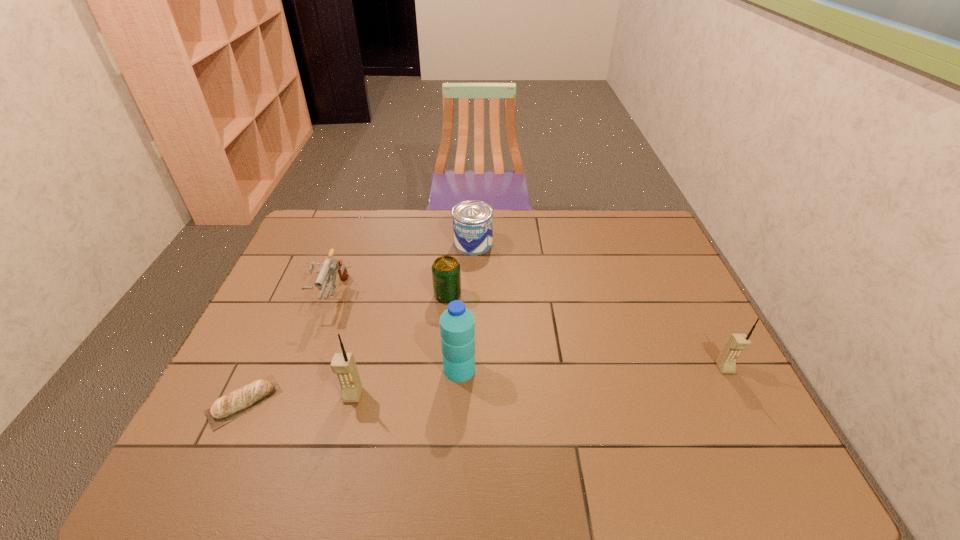
At what (x,y) coordinates should I click in order to perform the action: click on vacant region located on the front of the farther cellular telephone, where the keypad is located. Please return your answer as a coordinate pair (x, y). Looking at the image, I should click on (752, 421).

Image resolution: width=960 pixels, height=540 pixels. In order to click on free space located 0.370m on the front of the beer can in this screenshot , I will do (438, 416).

Identify the location of vacant region located 0.160m at the barrel end of the gun. Image resolution: width=960 pixels, height=540 pixels. (307, 366).

Identify the location of vacant space located on the front label of the farthest object. (550, 244).

I want to click on free location located 0.130m on the back of the water bottle, so click(462, 321).

Where is `vacant space located on the right of the pita bread`? vacant space located on the right of the pita bread is located at coordinates (317, 402).

Find the location of a particular element. object located in the far edge section of the desktop is located at coordinates (472, 220).

Locate an element on the screen. cellular telephone present at the near edge is located at coordinates (343, 364).

You are a GUI agent. You are given a task and a screenshot of the screen. Output one action in this format:
    pyautogui.click(x=<x>, y=<y>)
    Task: Click on the pita bread positioned at the near edge
    The width and height of the screenshot is (960, 540).
    Given the screenshot: What is the action you would take?
    pyautogui.click(x=226, y=408)

The height and width of the screenshot is (540, 960). In order to click on gun present at the left edge in this screenshot , I will do `click(329, 267)`.